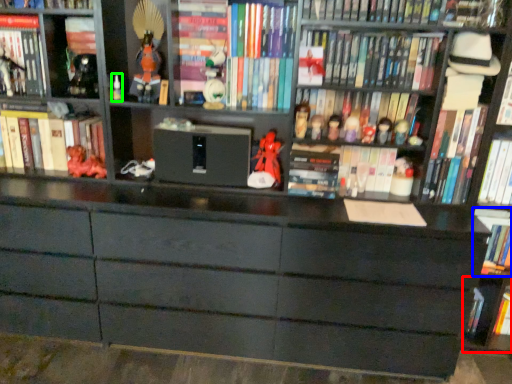
Question: Which is nearer to the cabinet (highlighted by a red box)? book (highlighted by a blue box) or toy (highlighted by a green box).

Choices:
 (A) book
 (B) toy

Answer: (A)